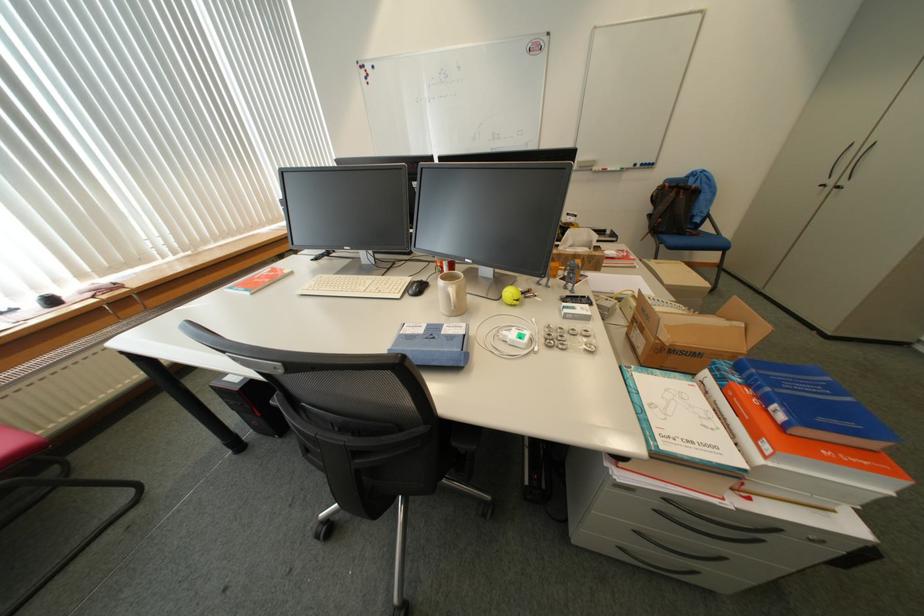
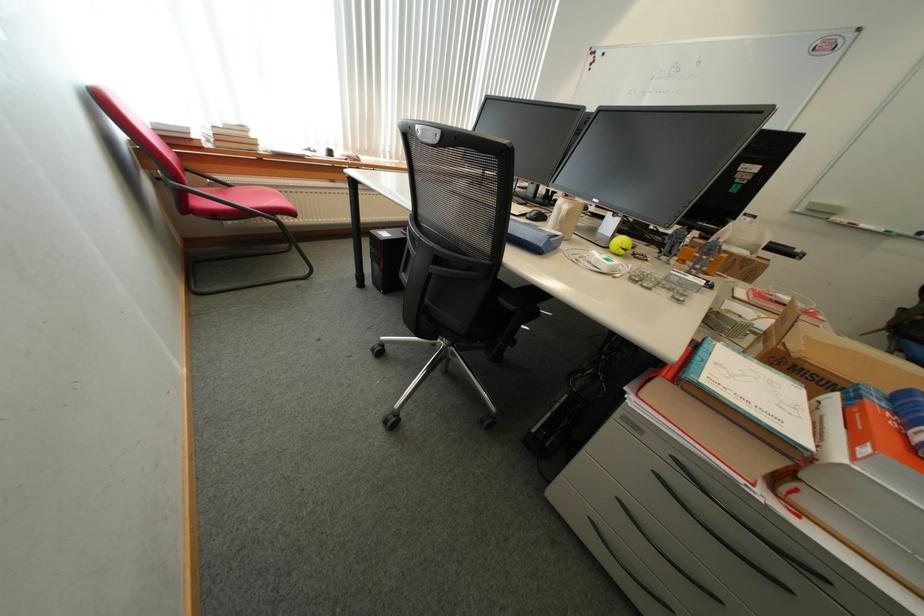
Question: How did the camera likely rotate?

Choices:
 (A) Left
 (B) Right
 (C) Up
 (D) Down

Answer: (A)